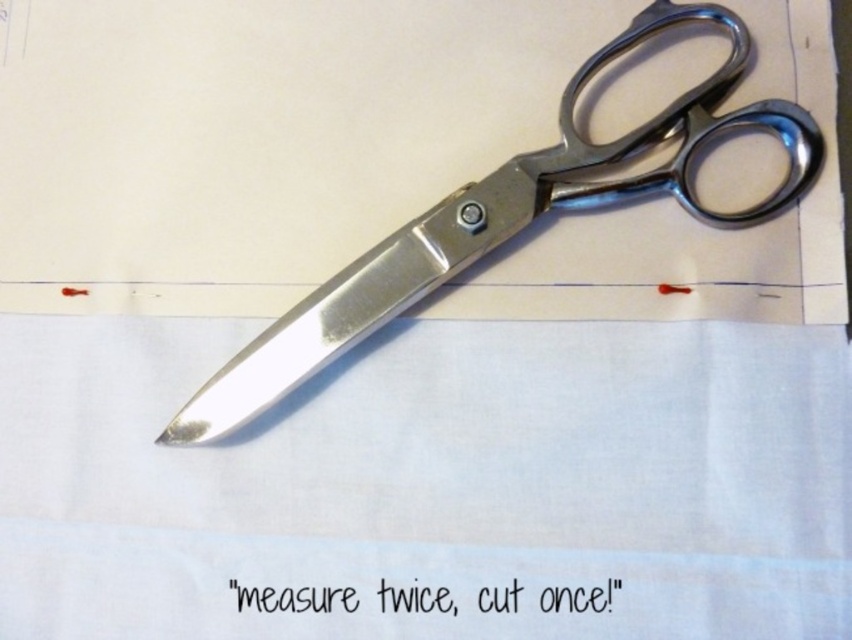
Between white fabric at center and polished metal scissors at center, which one appears on the right side from the viewer's perspective?

From the viewer's perspective, polished metal scissors at center appears more on the right side.

Identify the location of white fabric at center. (430, 483).